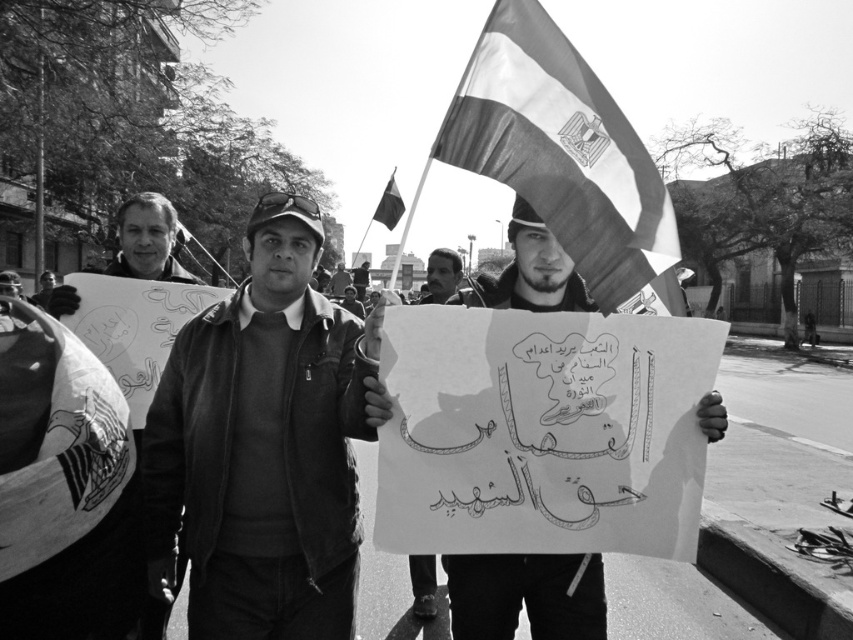
Does dark gray leather jacket at center come in front of smooth leather jacket at center?

That is True.

Which of these two, dark gray leather jacket at center or smooth leather jacket at center, stands taller?

Standing taller between the two is smooth leather jacket at center.

Locate an element on the screen. The width and height of the screenshot is (853, 640). dark gray leather jacket at center is located at coordinates (263, 445).

The width and height of the screenshot is (853, 640). I want to click on dark gray leather jacket at center, so click(x=263, y=445).

Can you confirm if dark gray leather jacket at center is smaller than white paper sign at center?

Incorrect, dark gray leather jacket at center is not smaller in size than white paper sign at center.

Measure the distance from dark gray leather jacket at center to white paper sign at center.

dark gray leather jacket at center is 31.38 inches away from white paper sign at center.

This screenshot has height=640, width=853. What do you see at coordinates (263, 445) in the screenshot?
I see `dark gray leather jacket at center` at bounding box center [263, 445].

Where is `dark gray leather jacket at center`? This screenshot has height=640, width=853. dark gray leather jacket at center is located at coordinates (263, 445).

Is point (202, 442) less distant than point (398, 198)?

Yes, point (202, 442) is closer to viewer.

Between dark gray leather jacket at center and silky fabric flag at upper center, which one is positioned lower?

Positioned lower is dark gray leather jacket at center.

Which is behind, point (291, 280) or point (397, 198)?

The point (397, 198) is more distant.

Where is `dark gray leather jacket at center`? The image size is (853, 640). dark gray leather jacket at center is located at coordinates (263, 445).